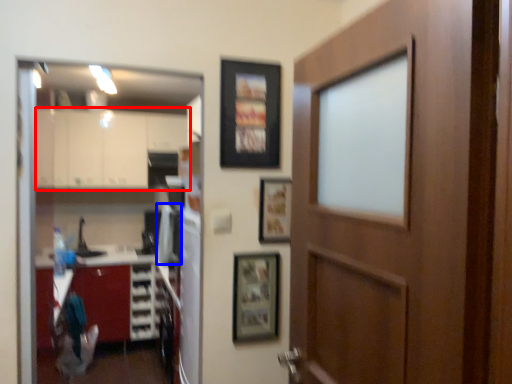
Question: Which point is closer to the camera, cabinetry (highlighted by a red box) or appliance (highlighted by a blue box)?

Choices:
 (A) cabinetry
 (B) appliance

Answer: (B)